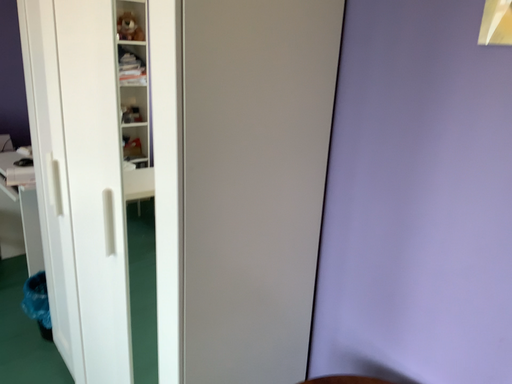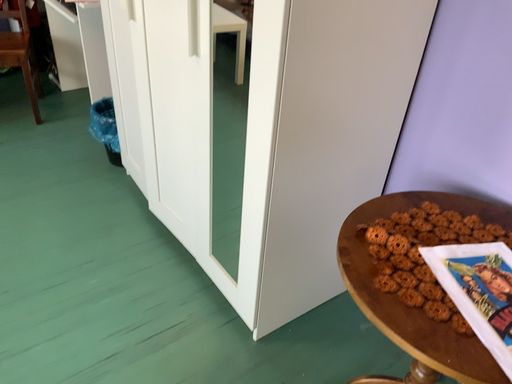
Question: Which way did the camera rotate in the video?

Choices:
 (A) rotated upward
 (B) rotated downward

Answer: (B)